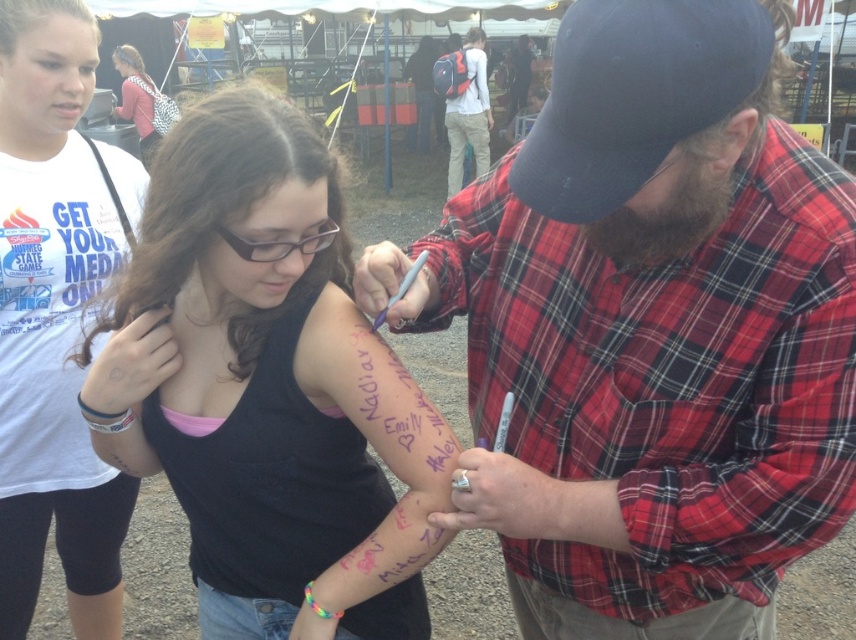
Who is lower down, black matte tank top at center or matte pink shirt at upper left?

black matte tank top at center is below.

Who is taller, black matte tank top at center or matte pink shirt at upper left?

matte pink shirt at upper left

Which is behind, point (418, 600) or point (171, 113)?

The point (171, 113) is behind.

The width and height of the screenshot is (856, 640). I want to click on black matte tank top at center, so click(269, 381).

At what (x,y) coordinates should I click in order to perform the action: click on white t-shirt at upper left. Please return your answer as a coordinate pair (x, y). The image size is (856, 640). Looking at the image, I should click on (52, 321).

Does white t-shirt at upper left have a smaller size compared to red plaid shirt at upper center?

Indeed, white t-shirt at upper left has a smaller size compared to red plaid shirt at upper center.

What are the coordinates of `white t-shirt at upper left` in the screenshot? It's located at (52, 321).

Is red plaid shirt at center to the left of white t-shirt at upper left from the viewer's perspective?

Incorrect, red plaid shirt at center is not on the left side of white t-shirt at upper left.

Looking at this image, is red plaid shirt at center taller than white t-shirt at upper left?

No, red plaid shirt at center is not taller than white t-shirt at upper left.

Describe the element at coordinates (652, 332) in the screenshot. I see `red plaid shirt at center` at that location.

Identify the location of red plaid shirt at center. Image resolution: width=856 pixels, height=640 pixels. (652, 332).